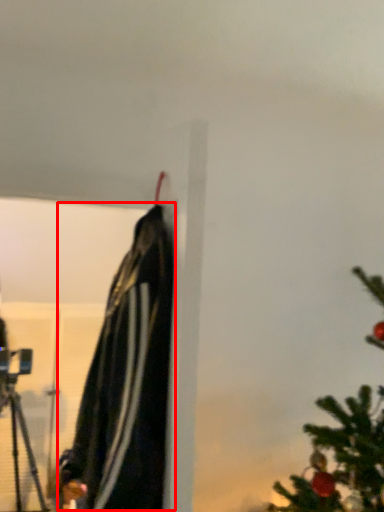
Question: From the image's perspective, where is cloak (annotated by the red box) located relative to tripod?

Choices:
 (A) below
 (B) above

Answer: (B)